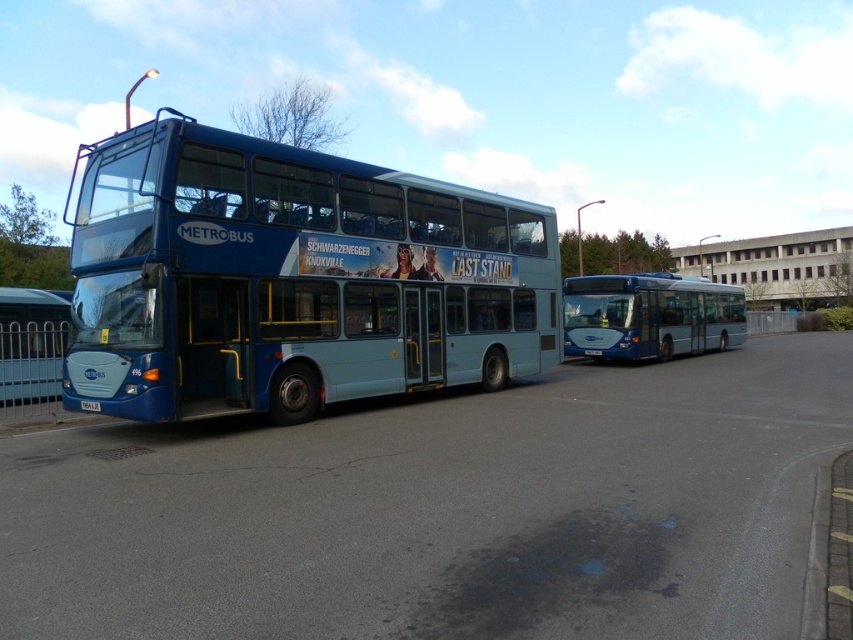
Consider the image. You are a delivery person who needs to attach a large package to the blue metallic bus at center. You see the white plastic license plate at center. Can you place the package on top of the license plate?

The blue metallic bus at center is larger in size than the white plastic license plate at center, so the license plate may not provide enough surface area to securely hold a large package. It would be safer to attach the package to another part of the bus.

You are a passenger waiting at the bus stop and see both the blue metallic bus at center and the glossy blue bus at center. Which one is closer to you?

The glossy blue bus at center is closer to you because the blue metallic bus at center is located above it, indicating it is further away.